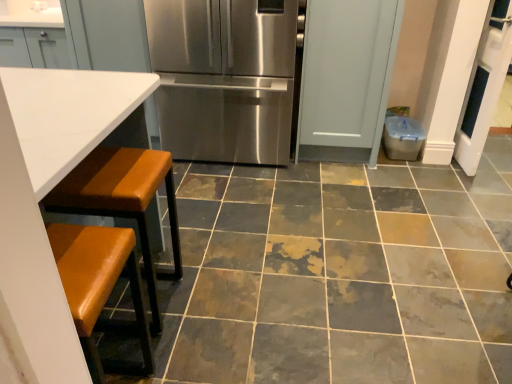
Question: In the image, is marble-like ceramic tile at center positioned in front of or behind stainless steel refrigerator at center?

Choices:
 (A) behind
 (B) front

Answer: (B)

Question: In the image, is marble-like ceramic tile at center on the left side or the right side of stainless steel refrigerator at center?

Choices:
 (A) left
 (B) right

Answer: (B)

Question: Estimate the real-world distances between objects in this image. Which object is closer to the marble-like ceramic tile at center?

Choices:
 (A) stainless steel refrigerator at center
 (B) brown leather stool at lower left
 (C) white leather table at left

Answer: (B)

Question: Considering the real-world distances, which object is farthest from the white leather table at left?

Choices:
 (A) brown leather stool at lower left
 (B) stainless steel refrigerator at center
 (C) marble-like ceramic tile at center

Answer: (C)